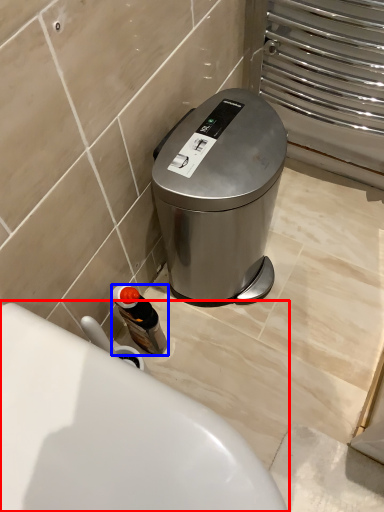
Question: Among these objects, which one is farthest to the camera, toilet (highlighted by a red box) or bottle (highlighted by a blue box)?

Choices:
 (A) toilet
 (B) bottle

Answer: (B)